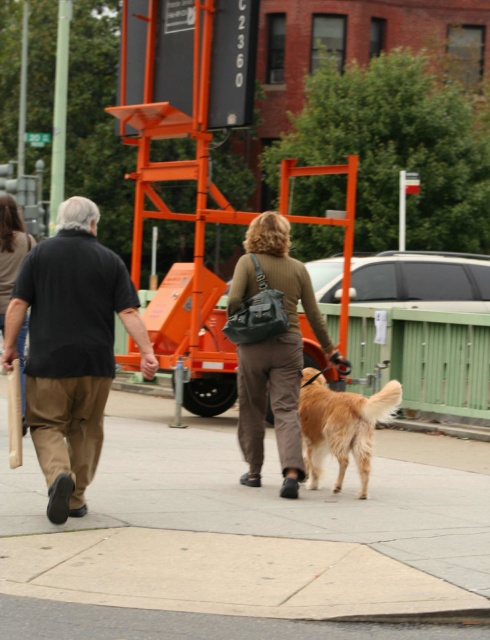
You are a pedestrian crossing a busy street and see the matte black shirt at left and the brown leather jacket at upper center in the distance. Which one is closer to you?

The matte black shirt at left is closer to you because it is in front of the brown leather jacket at upper center.

You are standing at the camera position looking at the scene. Where is the gray concrete sidewalk at center located in this image?

The gray concrete sidewalk at center is located at point (245, 540).